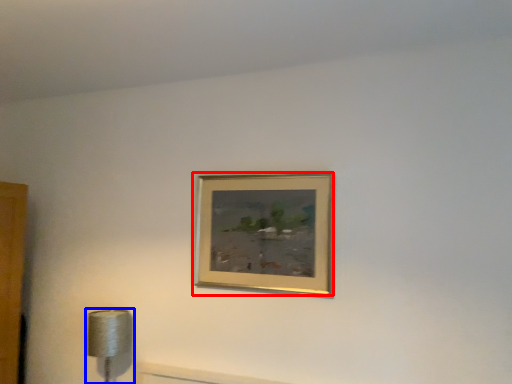
Question: Which object is closer to the camera taking this photo, picture frame (highlighted by a red box) or lamp (highlighted by a blue box)?

Choices:
 (A) picture frame
 (B) lamp

Answer: (A)